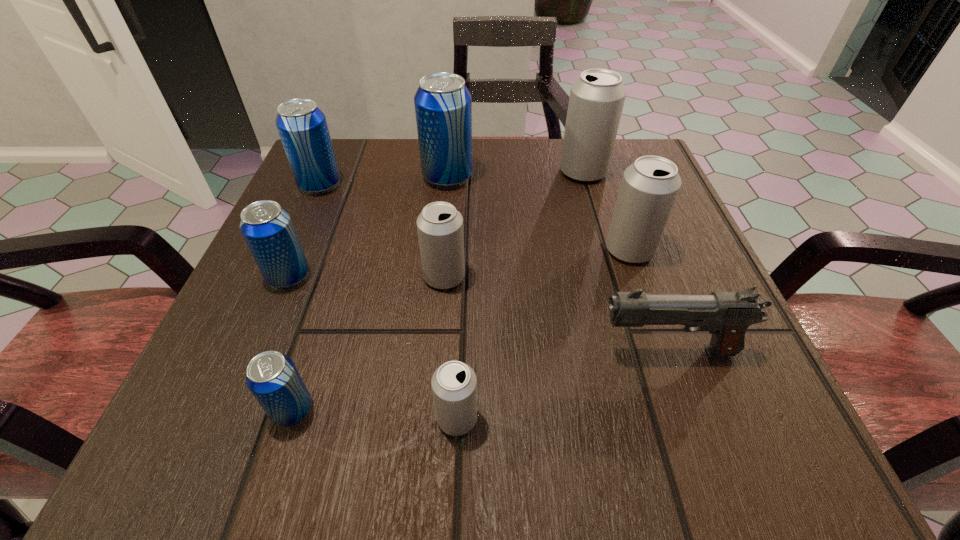
I want to click on vacant space located on the right of the third beer can from left to right, so click(x=528, y=410).

At what (x,y) coordinates should I click in order to perform the action: click on blank area located 0.060m on the right of the nearest white beer can. Please return your answer as a coordinate pair (x, y). Looking at the image, I should click on (526, 418).

Where is `gun located in the right edge section of the desktop`? The height and width of the screenshot is (540, 960). gun located in the right edge section of the desktop is located at coordinates (726, 315).

Find the location of a particular element. This screenshot has height=540, width=960. object that is at the far left corner is located at coordinates (302, 126).

In order to click on object that is at the near left corner in this screenshot , I will do `click(273, 379)`.

At what (x,y) coordinates should I click in order to perform the action: click on object that is at the far right corner. Please return your answer as a coordinate pair (x, y). Looking at the image, I should click on (597, 97).

In the image, there is a desktop. At what (x,y) coordinates should I click in order to perform the action: click on blank space at the far edge. Please return your answer as a coordinate pair (x, y). The width and height of the screenshot is (960, 540). Looking at the image, I should click on (378, 189).

The image size is (960, 540). I want to click on free space at the near edge of the desktop, so click(579, 465).

At what (x,y) coordinates should I click in order to perform the action: click on vacant space at the left edge. Please return your answer as a coordinate pair (x, y). Image resolution: width=960 pixels, height=540 pixels. Looking at the image, I should click on (304, 214).

Locate an element on the screen. The height and width of the screenshot is (540, 960). vacant space at the right edge is located at coordinates (749, 354).